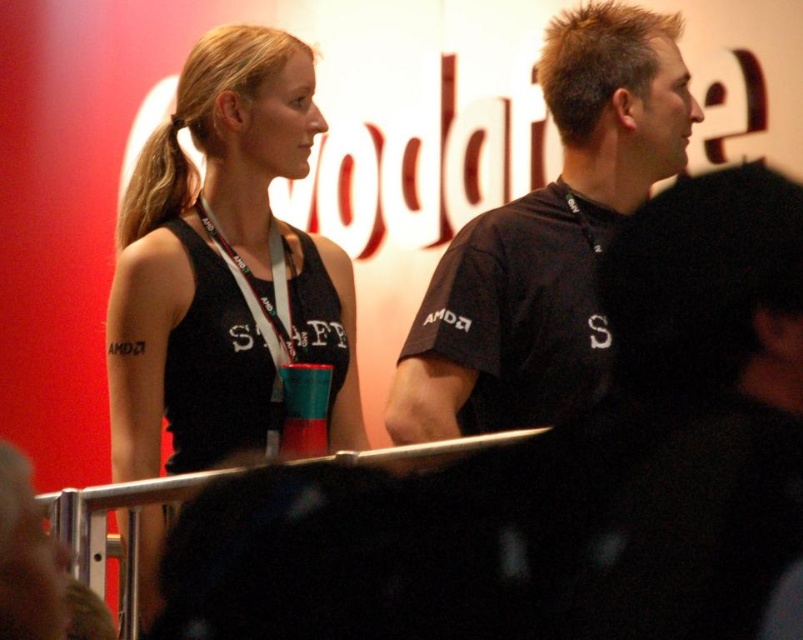
Where is the black matte tank top at upper left located in the image?

The black matte tank top at upper left is located at point (225, 268).

You are organizing a clothing sale and need to determine if the black matte tank top at upper left can fit into a display box designed for shirts with a width of 40 cm. Given that the black matte shirt at upper right is wider, what is the maximum width the tank top could have?

The black matte tank top at upper left has a width less than the black matte shirt at upper right. Since the shirt is wider, the tank top could have a maximum width just under 40 cm, so it might fit in the display box designed for shirts with a width of 40 cm.